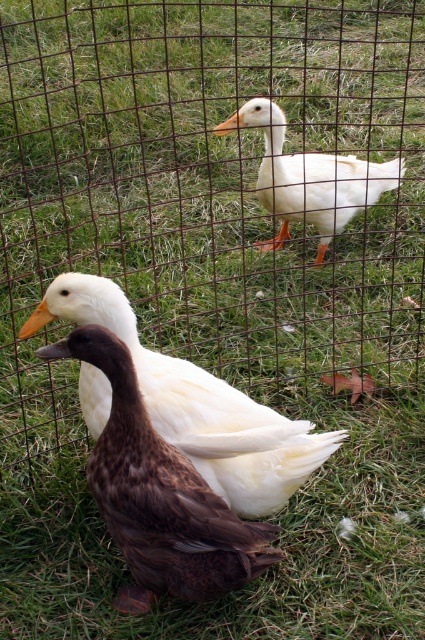
Question: Can you confirm if brown feathered duck at center is positioned below white matte duck at upper center?

Choices:
 (A) no
 (B) yes

Answer: (B)

Question: Does brown feathered duck at center have a smaller size compared to white matte duck at upper center?

Choices:
 (A) no
 (B) yes

Answer: (B)

Question: Which point is farther from the camera taking this photo?

Choices:
 (A) (255, 108)
 (B) (221, 451)

Answer: (A)

Question: Which object is closer to the camera taking this photo?

Choices:
 (A) white matte duck at upper center
 (B) white matte duck at center

Answer: (B)

Question: Among these objects, which one is farthest from the camera?

Choices:
 (A) brown feathered duck at center
 (B) white matte duck at upper center

Answer: (B)

Question: Is brown feathered duck at center in front of white matte duck at upper center?

Choices:
 (A) no
 (B) yes

Answer: (B)